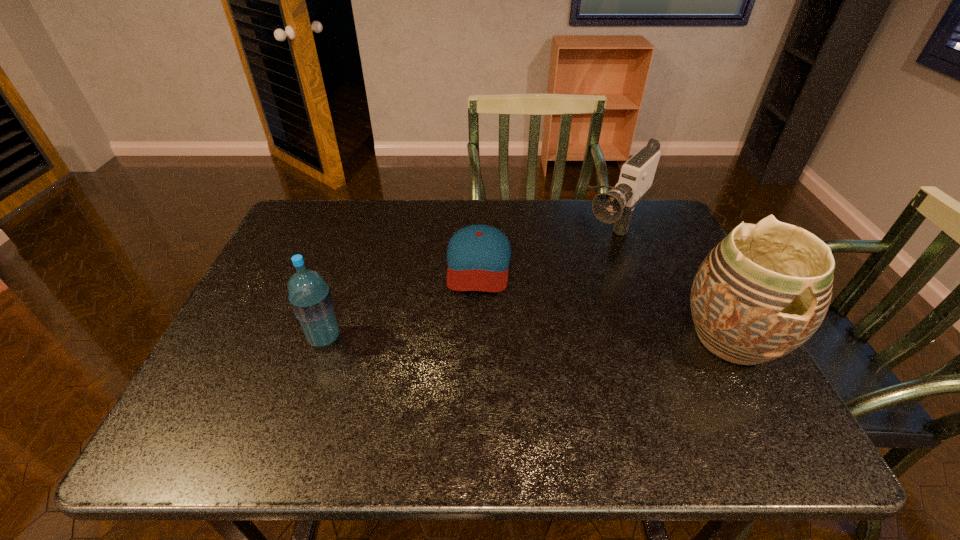
Image resolution: width=960 pixels, height=540 pixels. I want to click on free space on the desktop that is between the water bottle and the pottery and is positioned on the recording direction of the camcorder, so click(509, 338).

Identify the location of vacant space on the desktop that is between the leftmost object and the pottery and is positioned with the bill of the third object from right to left facing forward. This screenshot has width=960, height=540. point(472,338).